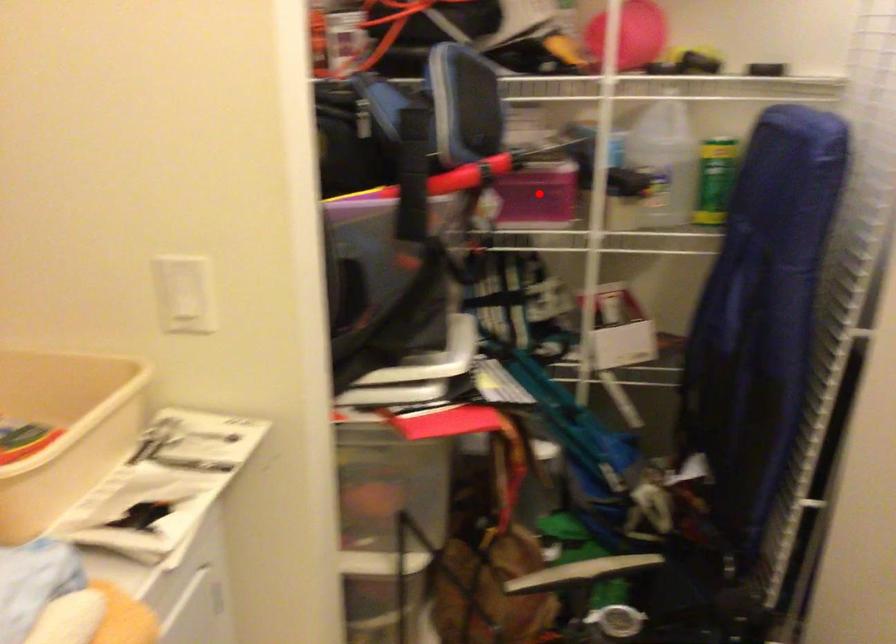
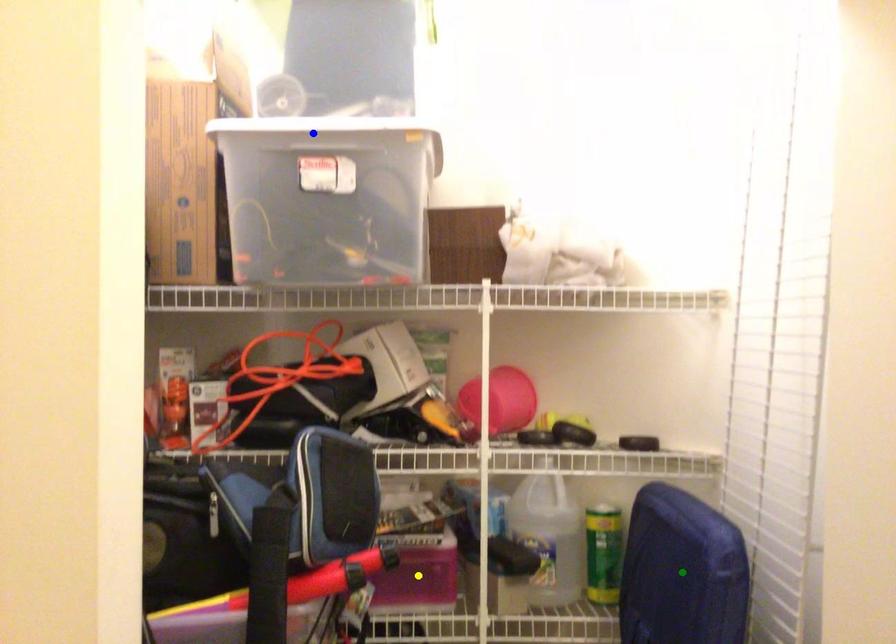
Question: I am providing you with two images of the same scene from different viewpoints. A red point is marked on the first image. You are given multiple points on the second image. Which point in image 2 represents the same 3d spot as the red point in image 1?

Choices:
 (A) green point
 (B) yellow point
 (C) blue point

Answer: (B)